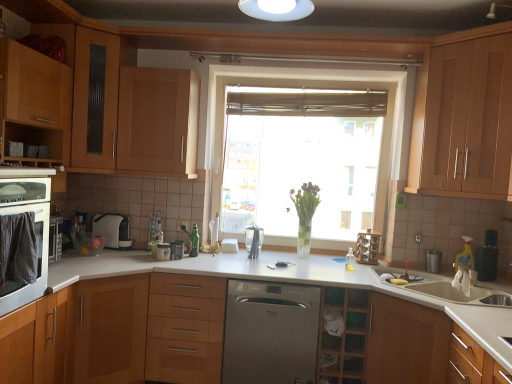
Question: From the image's perspective, is translucent glass window at center above or below wooden drawer at center?

Choices:
 (A) above
 (B) below

Answer: (A)

Question: Considering the relative positions of translucent glass window at center and wooden drawer at center in the image provided, is translucent glass window at center to the left or to the right of wooden drawer at center?

Choices:
 (A) right
 (B) left

Answer: (A)

Question: Based on their relative distances, which object is nearer to the yellow plastic spray bottle at right, positioned as the 1th appliance in right-to-left order?

Choices:
 (A) wooden cabinet at upper center, placed as the fourth cabinetry when sorted from left to right
 (B) satin silver knife block at center, which appears as the second appliance when viewed from the right
 (C) green plastic faucet at center
 (D) translucent glass window at center
 (E) clear glass vase at center

Answer: (E)

Question: Based on their relative distances, which object is nearer to the wooden cabinet at upper center, the third cabinetry positioned from the right?

Choices:
 (A) wooden cabinet at left, arranged as the third cabinetry when viewed from the left
 (B) wooden drawer at center
 (C) wooden cabinet at left, which appears as the sixth cabinetry when viewed from the right
 (D) wooden cabinet at upper right, the sixth cabinetry from the left
 (E) matte white oven at left

Answer: (C)